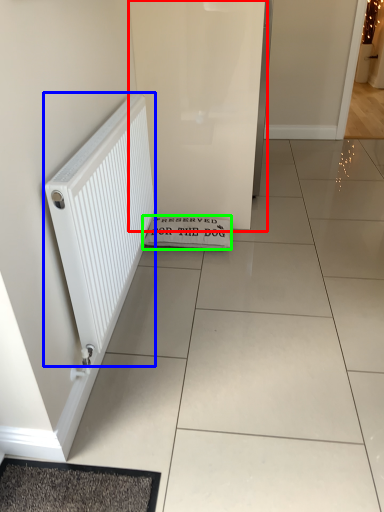
Question: Which is farther away from screen door (highlighted by a red box)? radiator (highlighted by a blue box) or doormat (highlighted by a green box)?

Choices:
 (A) radiator
 (B) doormat

Answer: (A)